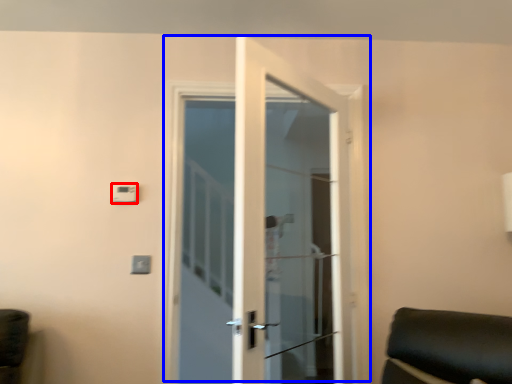
Question: Which object appears farthest to the camera in this image, light switch (highlighted by a red box) or door (highlighted by a blue box)?

Choices:
 (A) light switch
 (B) door

Answer: (A)